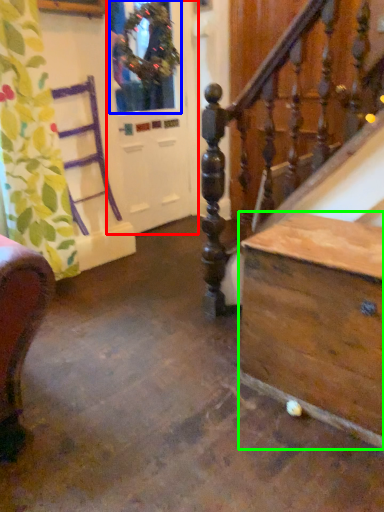
Question: Which object is the closest to the screen door (highlighted by a red box)? Choose among these: window (highlighted by a blue box) or table (highlighted by a green box).

Choices:
 (A) window
 (B) table

Answer: (A)